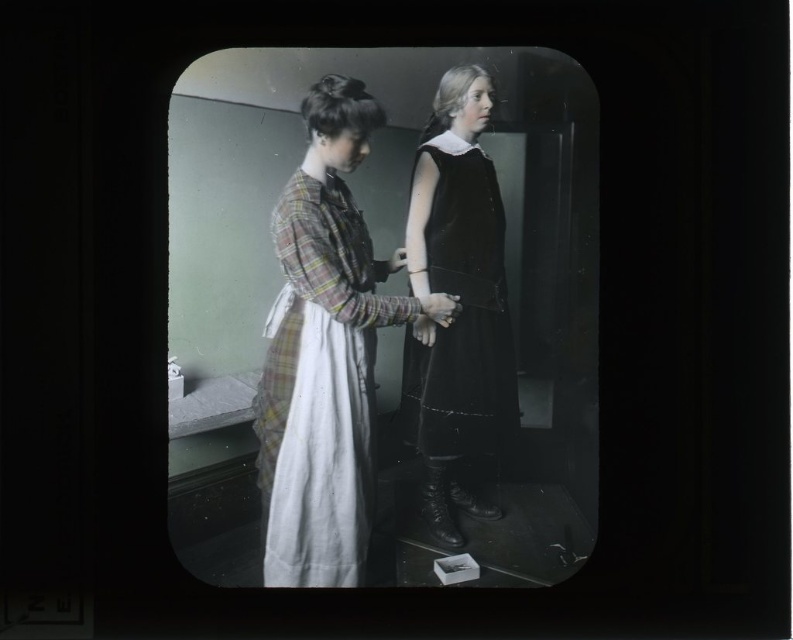
You are a photographer analyzing the composition of this vintage image. The velvet black dress at center and smooth white glove at center are both central to the frame. Based on their arrangement, which object is closer to the camera?

The velvet black dress at center is closer to the camera because it is positioned in front of the smooth white glove at center.

You are a tailor measuring the plaid fabric dress at center and the smooth white glove at center for alterations. Which item requires a larger piece of fabric based on their sizes?

The plaid fabric dress at center requires a larger piece of fabric because it is larger in size than the smooth white glove at center.

You are standing in the room depicted in the vintage photograph. You notice a point marked at coordinates (322, 353). What object is located at this point?

The plaid fabric dress at center is located at point (322, 353).